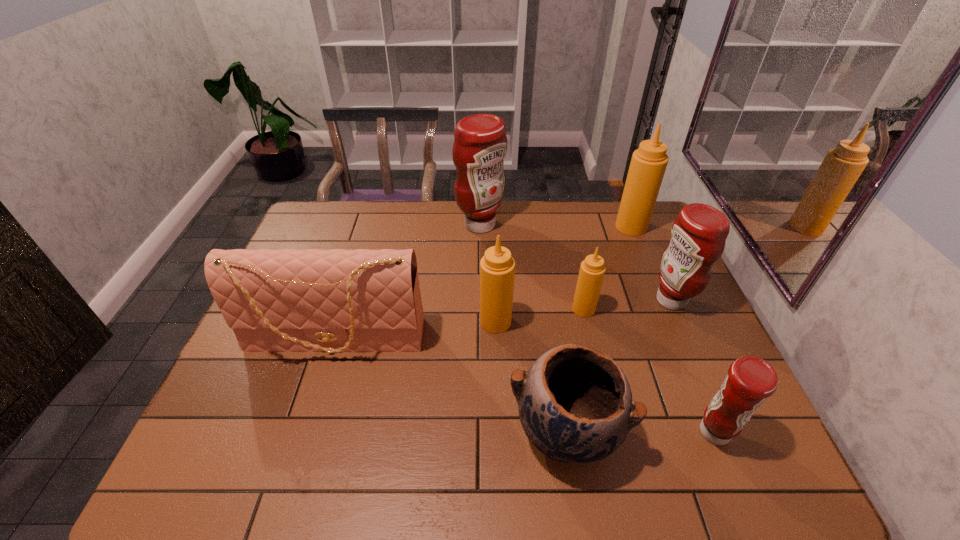
Locate an element on the screen. the nearest condiment is located at coordinates (750, 380).

Where is `the nearest red condiment`? the nearest red condiment is located at coordinates (750, 380).

Locate an element on the screen. Image resolution: width=960 pixels, height=540 pixels. pottery is located at coordinates (575, 404).

Identify the location of free spot located on the left of the leftmost red condiment. The width and height of the screenshot is (960, 540). (356, 225).

The image size is (960, 540). In order to click on free space located 0.220m on the front of the rightmost tan condiment in this screenshot , I will do `click(654, 281)`.

The height and width of the screenshot is (540, 960). Find the location of `vacant space located on the left of the second farthest red condiment`. vacant space located on the left of the second farthest red condiment is located at coordinates (614, 300).

At what (x,y) coordinates should I click in order to perform the action: click on vacant space located 0.320m on the front of the second biggest tan condiment. Please return your answer as a coordinate pair (x, y). Image resolution: width=960 pixels, height=540 pixels. Looking at the image, I should click on (500, 448).

You are a GUI agent. You are given a task and a screenshot of the screen. Output one action in this format:
    pyautogui.click(x=<x>, y=<y>)
    Task: Click on the vacant space located 0.170m on the front-facing side of the leftmost object
    The image size is (960, 540).
    Given the screenshot: What is the action you would take?
    click(308, 429)

At what (x,y) coordinates should I click in order to perform the action: click on free space located on the left of the smallest tan condiment. Please return your answer as a coordinate pair (x, y). This screenshot has width=960, height=540. Looking at the image, I should click on (516, 309).

Locate an element on the screen. Image resolution: width=960 pixels, height=540 pixels. free location located on the back of the nearest red condiment is located at coordinates pos(684,359).